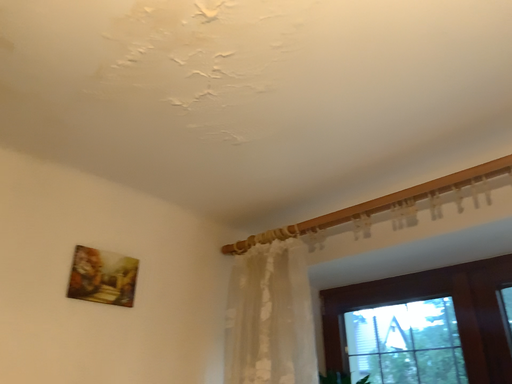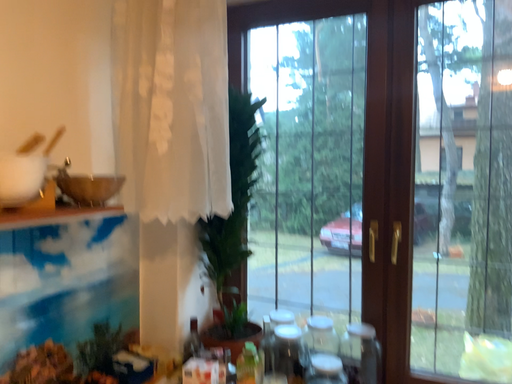
Question: How did the camera likely rotate when shooting the video?

Choices:
 (A) rotated left
 (B) rotated right

Answer: (B)